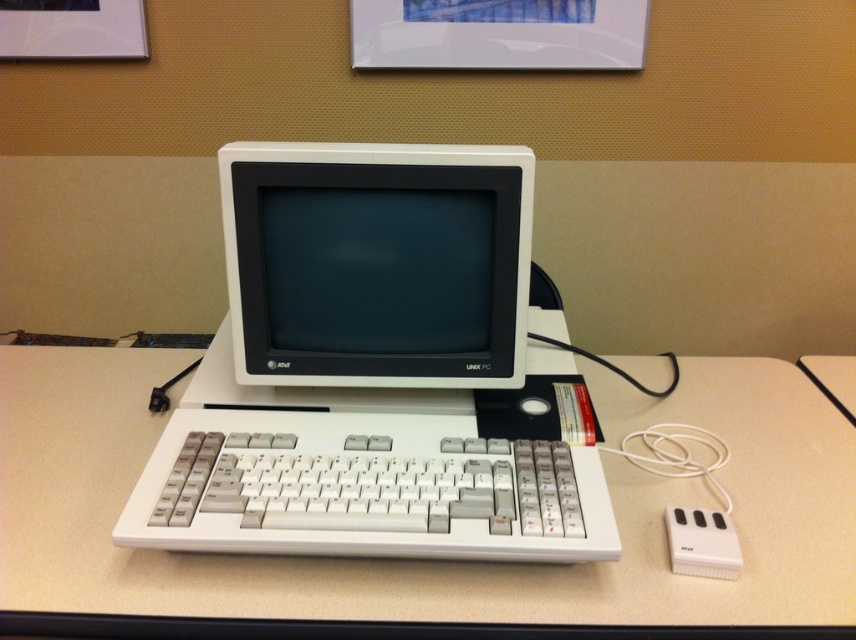
Question: Among these points, which one is farthest from the camera?

Choices:
 (A) (507, 513)
 (B) (500, 282)

Answer: (B)

Question: Estimate the real-world distances between objects in this image. Which object is closer to the white plastic computer desk at center?

Choices:
 (A) white plastic monitor at center
 (B) white plastic computer at center

Answer: (B)

Question: Is white plastic computer desk at center to the left of white plastic keyboard at center from the viewer's perspective?

Choices:
 (A) no
 (B) yes

Answer: (A)

Question: Is white plastic computer at center closer to camera compared to white plastic keyboard at center?

Choices:
 (A) no
 (B) yes

Answer: (A)

Question: Which point is closer to the camera?

Choices:
 (A) white plastic monitor at center
 (B) white plastic computer at center
 (C) white plastic computer desk at center
 (D) white plastic keyboard at center

Answer: (C)

Question: Is white plastic computer at center thinner than white plastic keyboard at center?

Choices:
 (A) no
 (B) yes

Answer: (A)